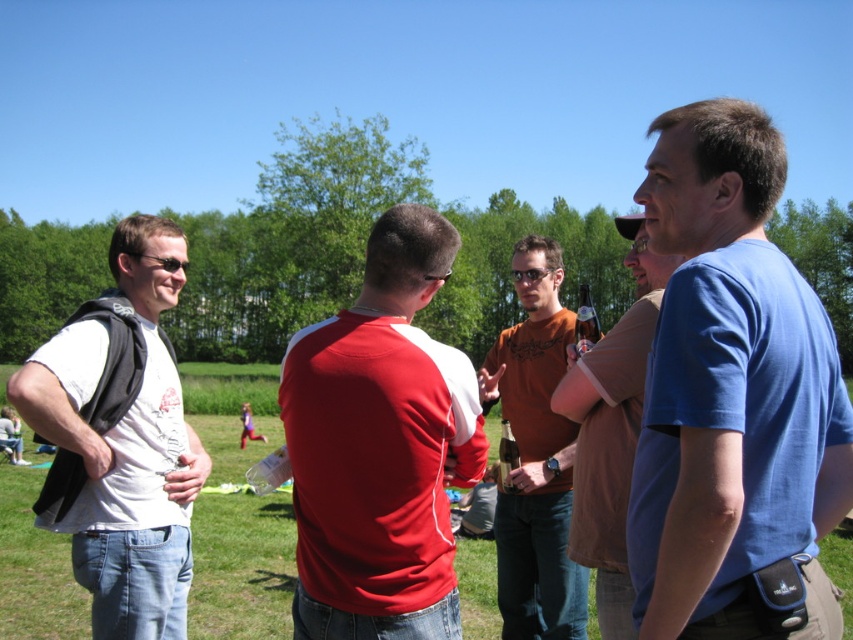
Question: Which is farther from the matte orange shirt at center?

Choices:
 (A) brown cotton t-shirt at center
 (B) white matte t-shirt at left
 (C) blue cotton shirt at right
 (D) matte red shirt at center

Answer: (B)

Question: Can you confirm if white matte t-shirt at left is wider than brown cotton t-shirt at center?

Choices:
 (A) yes
 (B) no

Answer: (B)

Question: Is blue cotton shirt at right closer to the viewer compared to white matte t-shirt at left?

Choices:
 (A) no
 (B) yes

Answer: (B)

Question: Estimate the real-world distances between objects in this image. Which object is farther from the brown cotton t-shirt at center?

Choices:
 (A) blue cotton shirt at right
 (B) matte red shirt at center
 (C) white matte t-shirt at left

Answer: (C)

Question: Which point is farther to the camera?

Choices:
 (A) matte orange shirt at center
 (B) matte red shirt at center

Answer: (A)

Question: Is matte orange shirt at center to the left of brown cotton t-shirt at center from the viewer's perspective?

Choices:
 (A) yes
 (B) no

Answer: (A)